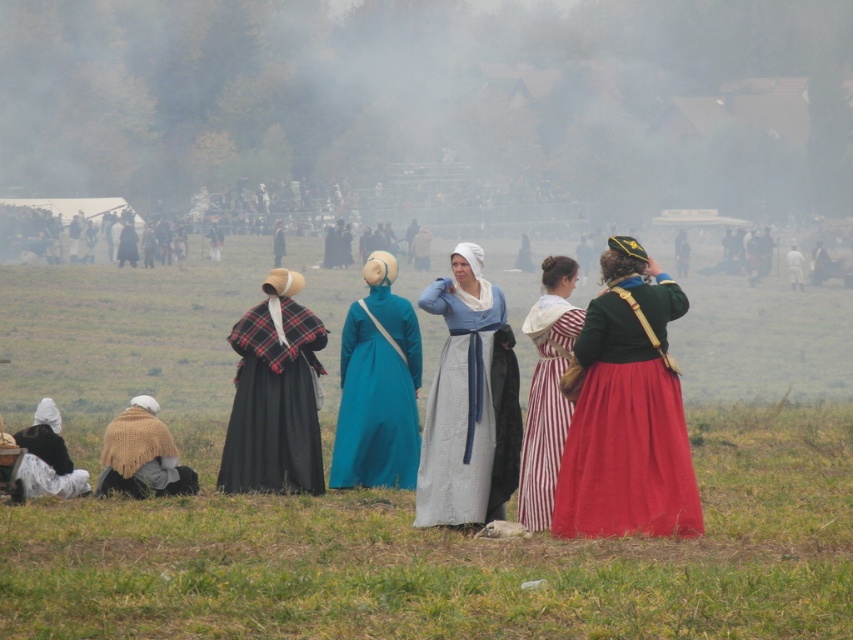
You are standing in the historical reenactment field and want to hand a leaflet to the person wearing the teal fabric dress at center. Considering the distance, can you comfortably walk to them without needing to run?

The teal fabric dress at center is 65.68 feet away from viewer. Walking that distance would be comfortable and you don not need to run.